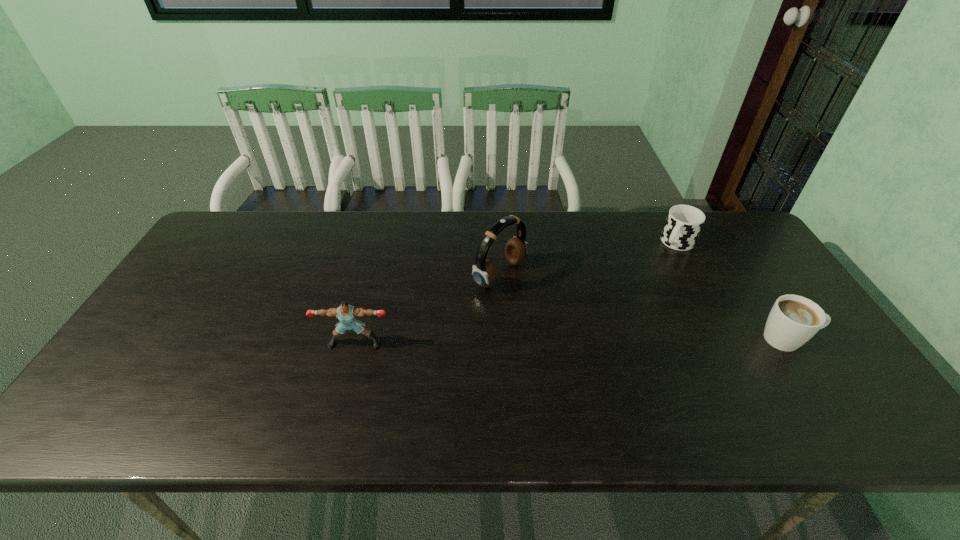
You are a GUI agent. You are given a task and a screenshot of the screen. Output one action in this format:
    pyautogui.click(x=<x>, y=<y>)
    Task: Click on the vacant spot on the desktop that is between the leftmost object and the rightmost object and is positioned on the ear cup of the third nearest object
    Image resolution: width=960 pixels, height=540 pixels.
    Given the screenshot: What is the action you would take?
    pyautogui.click(x=612, y=341)

Find the location of a particular element. free spot on the desktop that is between the puncher and the cappuccino and is positioned on the side of the farthest object with the handle is located at coordinates (597, 341).